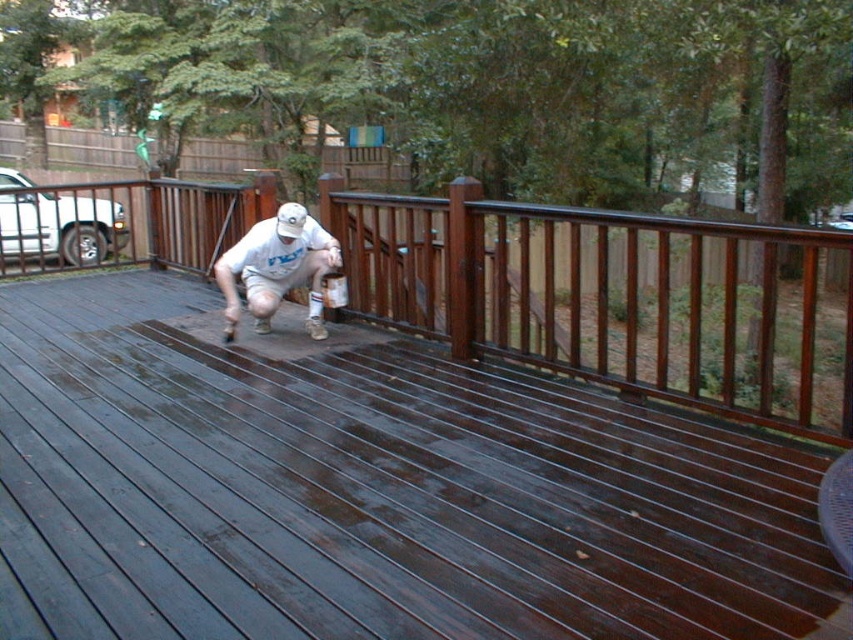
Does dark brown wood at center appear on the left side of matte white t-shirt at center?

In fact, dark brown wood at center is to the right of matte white t-shirt at center.

Does point (387, 256) lie in front of point (263, 262)?

No, (387, 256) is behind (263, 262).

Identify the location of dark brown wood at center. (616, 298).

Can you confirm if dark stained wood deck at center is taller than dark brown wood at center?

No, dark stained wood deck at center is not taller than dark brown wood at center.

The width and height of the screenshot is (853, 640). Identify the location of dark stained wood deck at center. (368, 490).

Where is `dark stained wood deck at center`? The width and height of the screenshot is (853, 640). dark stained wood deck at center is located at coordinates (368, 490).

Where is `dark stained wood deck at center`? dark stained wood deck at center is located at coordinates (368, 490).

Between point (200, 332) and point (318, 330), which one is positioned behind?

The point (200, 332) is more distant.

Who is more forward, (245, 380) or (310, 282)?

Point (245, 380) is more forward.

Locate an element on the screen. The width and height of the screenshot is (853, 640). dark stained wood deck at center is located at coordinates (368, 490).